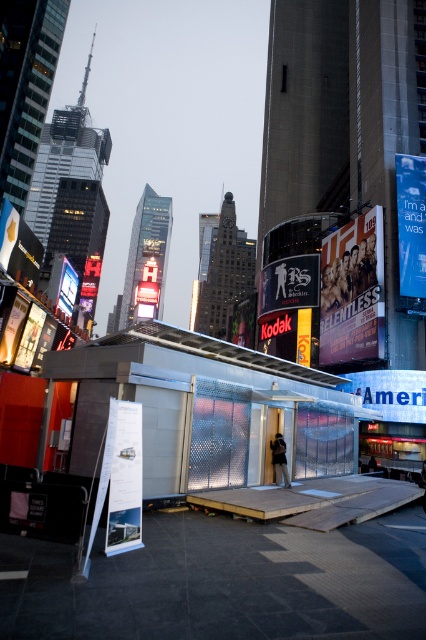
Who is taller, blue fabric billboard at center or matte black monitor at upper left?

matte black monitor at upper left is taller.

Where is `blue fabric billboard at center`? This screenshot has width=426, height=640. blue fabric billboard at center is located at coordinates (391, 392).

Does white paper at lower left have a greater width compared to matte black monitor at upper left?

No, white paper at lower left is not wider than matte black monitor at upper left.

Is white paper at lower left to the left of matte black monitor at upper left from the viewer's perspective?

In fact, white paper at lower left is to the right of matte black monitor at upper left.

Which is in front, point (141, 408) or point (60, 289)?

Point (141, 408) is more forward.

You are a GUI agent. You are given a task and a screenshot of the screen. Output one action in this format:
    pyautogui.click(x=<x>, y=<y>)
    Task: Click on the white paper at lower left
    The width and height of the screenshot is (426, 640).
    Given the screenshot: What is the action you would take?
    pyautogui.click(x=126, y=481)

How distant is blue fabric billboard at upper right from matte black monitor at upper left?

blue fabric billboard at upper right is 126.06 feet from matte black monitor at upper left.

Between point (420, 243) and point (71, 284), which one is positioned in front?

Point (420, 243) is more forward.

I want to click on blue fabric billboard at upper right, so click(411, 224).